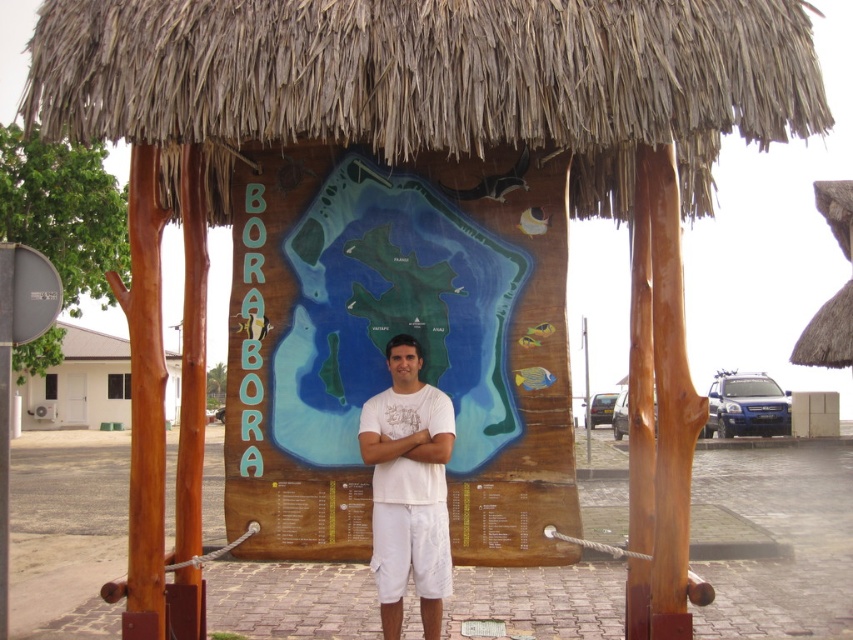
Between point (80, 365) and point (374, 422), which one is positioned behind?

The point (80, 365) is behind.

In the scene shown: Is white wood house at left behind white fabric at center?

Yes, it is.

Between point (126, 413) and point (384, 444), which one is positioned in front?

Positioned in front is point (384, 444).

Find the location of `white wood house at left`. white wood house at left is located at coordinates (80, 384).

Describe the element at coordinates (433, 80) in the screenshot. I see `brown thatch at upper center` at that location.

Does point (177, 80) lie behind point (79, 388)?

That is False.

Locate an element on the screen. brown thatch at upper center is located at coordinates (433, 80).

Does white cotton t-shirt at center have a larger size compared to white fabric at center?

Yes, white cotton t-shirt at center is bigger than white fabric at center.

Does point (381, 564) come in front of point (409, 442)?

No, it is not.

Locate an element on the screen. This screenshot has height=640, width=853. white cotton t-shirt at center is located at coordinates (408, 488).